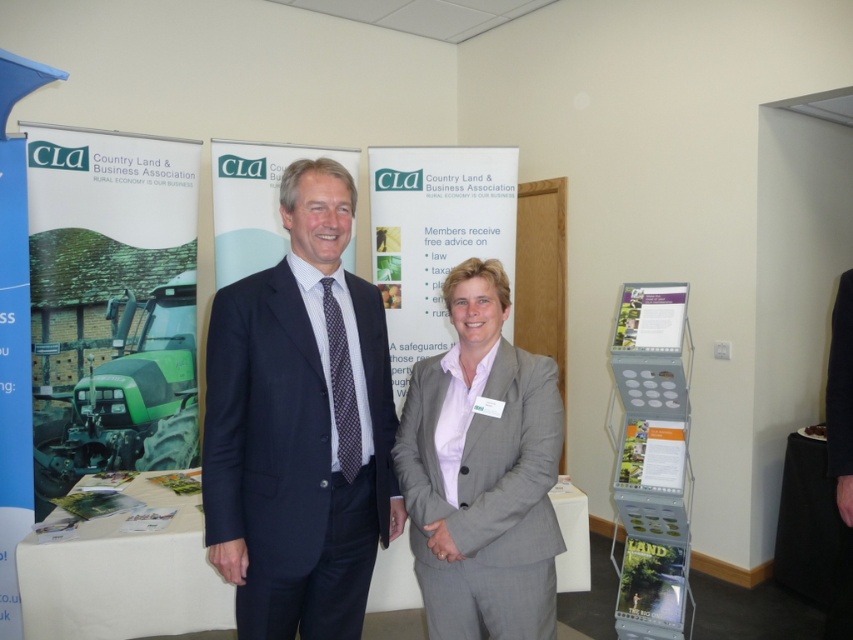
Question: From the image, what is the correct spatial relationship of matte paper poster at lower right in relation to green paper poster at center?

Choices:
 (A) left
 (B) right

Answer: (B)

Question: Which of these objects is positioned farthest from the green paper poster at center?

Choices:
 (A) white paper at right
 (B) dark blue suit at center

Answer: (B)

Question: Which of these objects is positioned farthest from the black smooth suit at right?

Choices:
 (A) dark blue suit at center
 (B) white paper at right

Answer: (A)

Question: Can you confirm if white paper at right is positioned to the left of green paper poster at center?

Choices:
 (A) yes
 (B) no

Answer: (A)

Question: Where is dark blue suit at center located in relation to matte black suit at center in the image?

Choices:
 (A) right
 (B) left

Answer: (A)

Question: Which point is farther to the camera?

Choices:
 (A) matte paper poster at lower right
 (B) dark blue suit at center
 (C) white paperboard at center
 (D) green paper poster at center

Answer: (C)